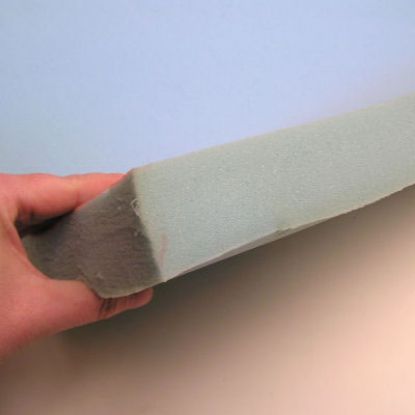
Locate an element on the screen. Image resolution: width=415 pixels, height=415 pixels. shadow on wall caused by foam is located at coordinates (199, 289).